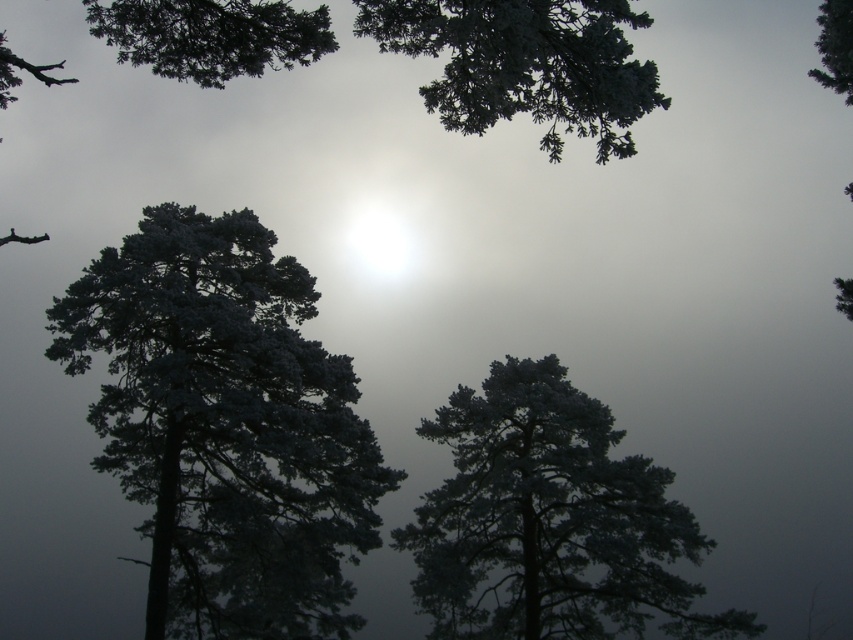
In the scene shown: You are standing in the winter scene and want to take a photo. There are two points marked in the image. Which point is closer to you, point (x=224, y=296) or point (x=589, y=486)?

Point (x=224, y=296) is closer to the camera than point (x=589, y=486), so it is closer to you.